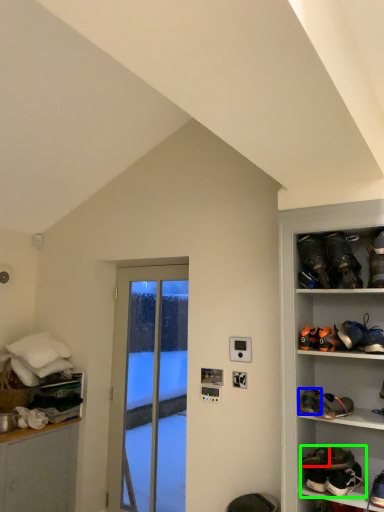
Question: Which object is positioned closest to footwear (highlighted by a red box)? Select from footwear (highlighted by a blue box) and footwear (highlighted by a green box).

Choices:
 (A) footwear
 (B) footwear

Answer: (B)